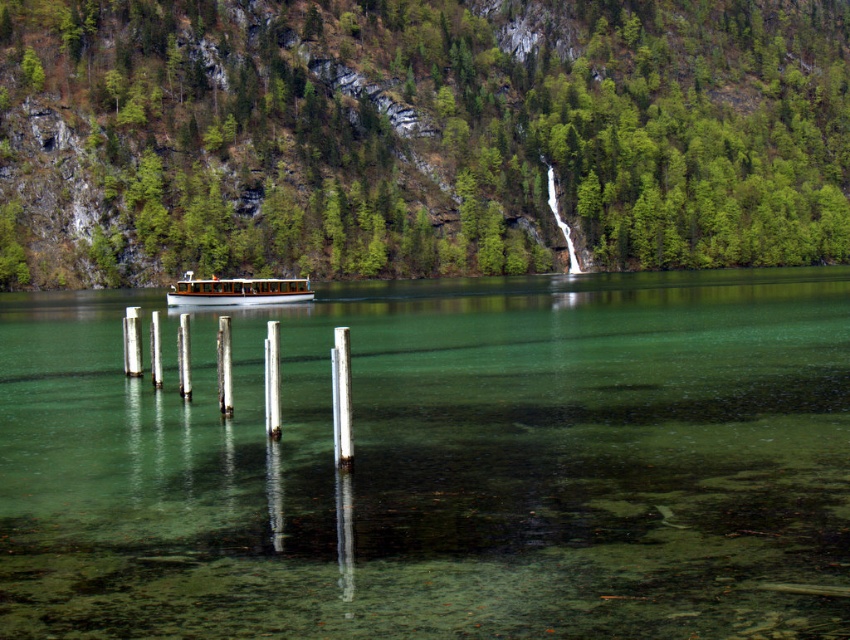
Question: Can you confirm if clear water at center is thinner than green forested mountain at upper center?

Choices:
 (A) no
 (B) yes

Answer: (B)

Question: Which of the following is the farthest from the observer?

Choices:
 (A) (187, 296)
 (B) (278, 257)
 (C) (803, 403)

Answer: (B)

Question: Which is nearer to the white polished wood boat at center?

Choices:
 (A) clear water at center
 (B) green forested mountain at upper center

Answer: (A)

Question: Does clear water at center come behind white polished wood boat at center?

Choices:
 (A) yes
 (B) no

Answer: (B)

Question: Which point is farther to the camera?

Choices:
 (A) (401, 8)
 (B) (129, 404)

Answer: (A)

Question: Does clear water at center have a greater width compared to white polished wood boat at center?

Choices:
 (A) yes
 (B) no

Answer: (A)